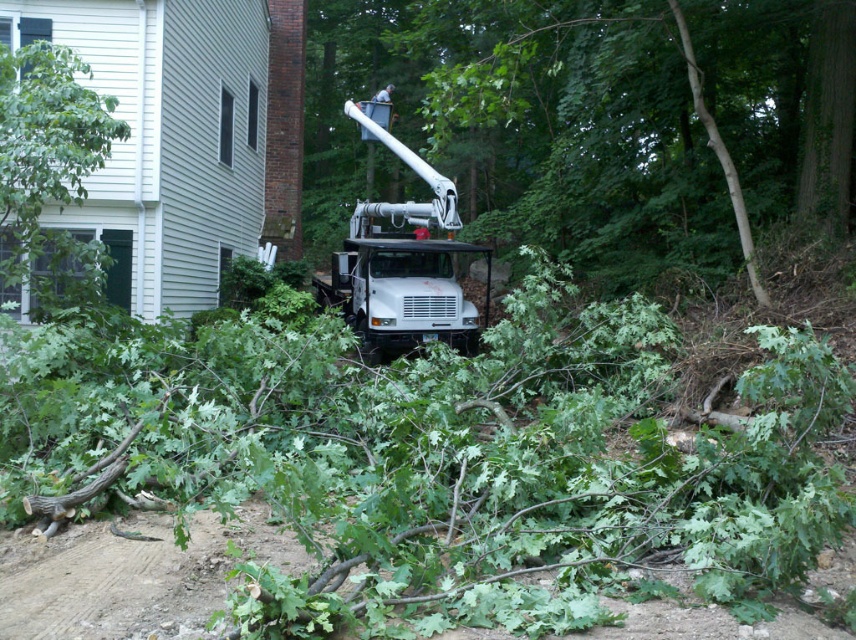
Question: Which object is the closest to the white metallic bucket truck at center?

Choices:
 (A) green leafy tree at left
 (B) green leafy tree at center

Answer: (B)

Question: Which object appears closest to the camera in this image?

Choices:
 (A) green leafy tree at center
 (B) green leafy tree at left
 (C) white metallic bucket truck at center

Answer: (B)

Question: Which of these objects is positioned closest to the green leafy tree at center?

Choices:
 (A) white metallic bucket truck at center
 (B) green leafy tree at left

Answer: (A)

Question: Is green leafy tree at center in front of green leafy tree at left?

Choices:
 (A) yes
 (B) no

Answer: (B)

Question: Can you confirm if green leafy tree at center is positioned below white metallic bucket truck at center?

Choices:
 (A) no
 (B) yes

Answer: (A)

Question: Does green leafy tree at center have a greater width compared to white metallic bucket truck at center?

Choices:
 (A) no
 (B) yes

Answer: (B)